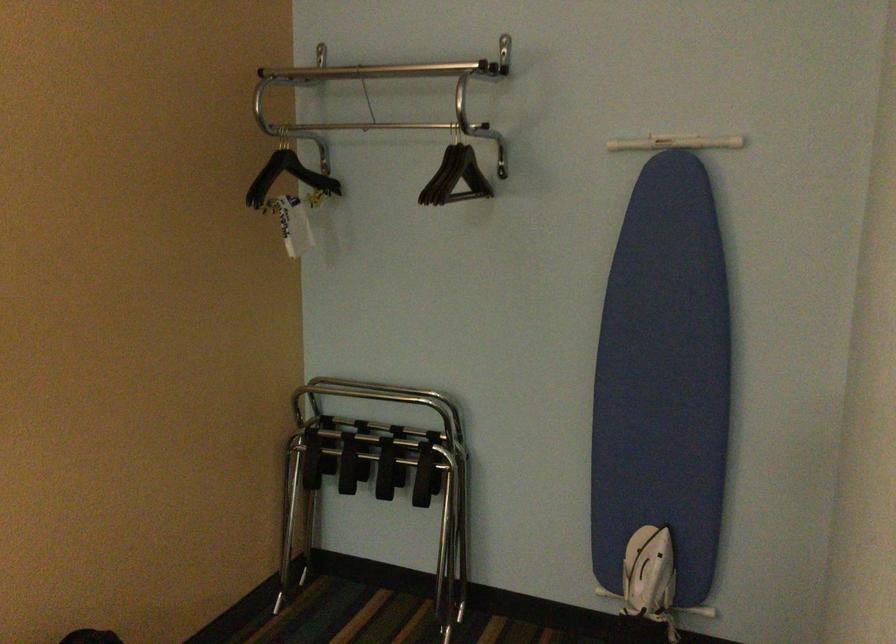
The height and width of the screenshot is (644, 896). I want to click on folding luggage rack, so click(380, 476).